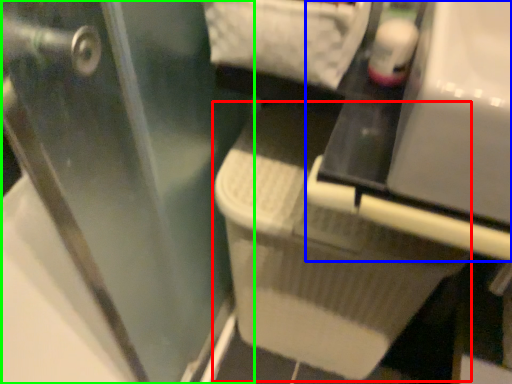
Question: Which object is positioned closest to laundry basket (highlighted by a red box)? Select from vanity (highlighted by a blue box) and screen door (highlighted by a green box).

Choices:
 (A) vanity
 (B) screen door

Answer: (B)